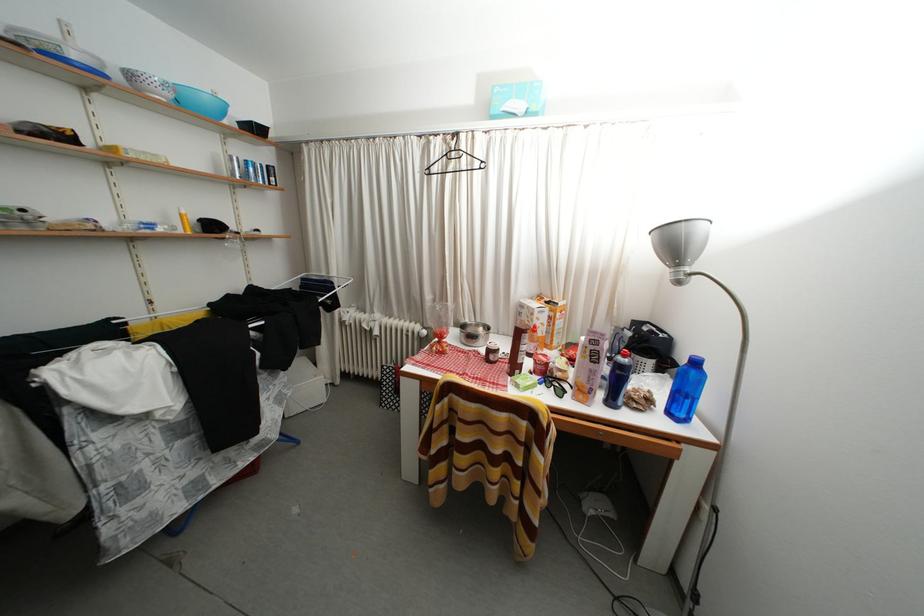
Identify the location of metal mixing bowl. Image resolution: width=924 pixels, height=616 pixels. (473, 333).